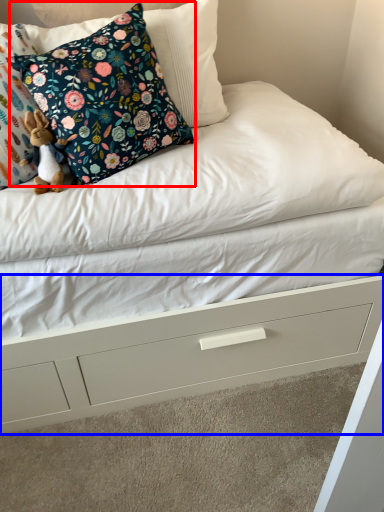
Question: Which object is closer to the camera taking this photo, pillow (highlighted by a red box) or drawer (highlighted by a blue box)?

Choices:
 (A) pillow
 (B) drawer

Answer: (A)